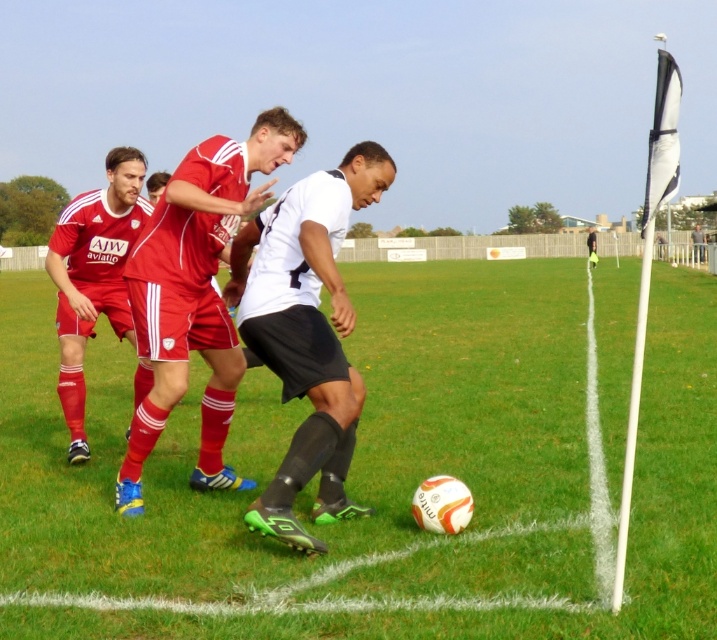
You are a soccer player positioned at point (x=94, y=525) on the field. You need to kick the ball to the camera position. What is the minimum distance you need to kick the ball to reach the camera?

The minimum distance you need to kick the ball to reach the camera is 5.22 meters, as the distance between point (x=94, y=525) and the camera is exactly 5.22 meters.

You are a soccer referee observing the field. You notice the white matte soccer ball at center and the black matte shorts at center. Which object is bigger in size?

The white matte soccer ball at center has a larger size compared to the black matte shorts at center, so the white matte soccer ball at center is bigger.

You are a soccer referee observing the field. You see the white matte soccer ball at center and the matte red shorts at center. Which object is located more to the left?

The white matte soccer ball at center is positioned on the left side of matte red shorts at center, so it is more to the left.